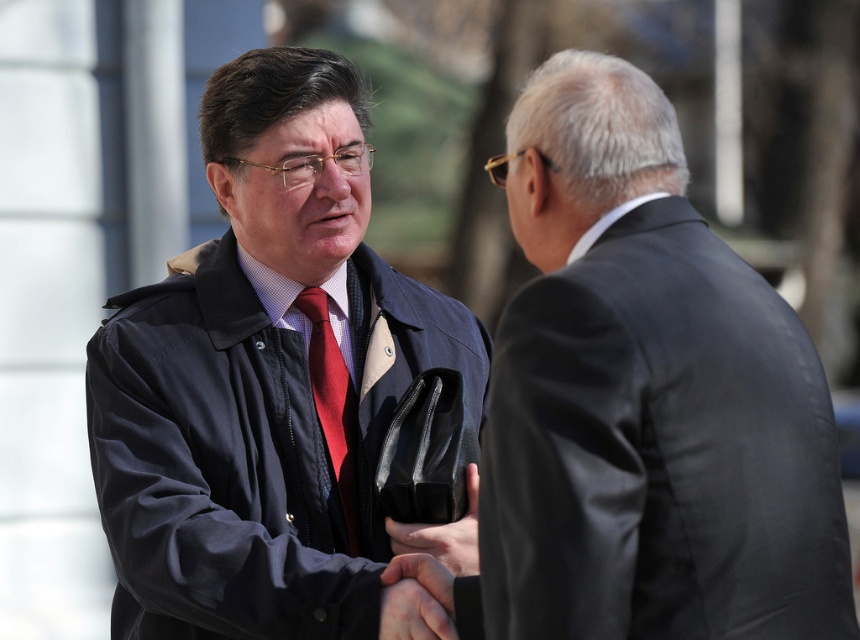
Does matte red tie at center have a larger size compared to black leather handbag at center?

Yes, matte red tie at center is bigger than black leather handbag at center.

Who is lower down, matte red tie at center or black leather handbag at center?

Positioned lower is black leather handbag at center.

Image resolution: width=860 pixels, height=640 pixels. Identify the location of matte red tie at center. (333, 404).

Can you confirm if black satin suit at right is wider than black leather handbag at center?

Yes.

Measure the distance between black satin suit at right and black leather handbag at center.

25.83 inches

What do you see at coordinates (645, 401) in the screenshot?
I see `black satin suit at right` at bounding box center [645, 401].

You are a GUI agent. You are given a task and a screenshot of the screen. Output one action in this format:
    pyautogui.click(x=<x>, y=<y>)
    Task: Click on the black satin suit at right
    This screenshot has width=860, height=640.
    Given the screenshot: What is the action you would take?
    pyautogui.click(x=645, y=401)

Based on the photo, can you confirm if black satin suit at right is positioned to the left of matte black jacket at center?

No, black satin suit at right is not to the left of matte black jacket at center.

This screenshot has height=640, width=860. What do you see at coordinates (645, 401) in the screenshot?
I see `black satin suit at right` at bounding box center [645, 401].

Locate an element on the screen. This screenshot has width=860, height=640. black satin suit at right is located at coordinates point(645,401).

This screenshot has width=860, height=640. What are the coordinates of `black satin suit at right` in the screenshot? It's located at 645,401.